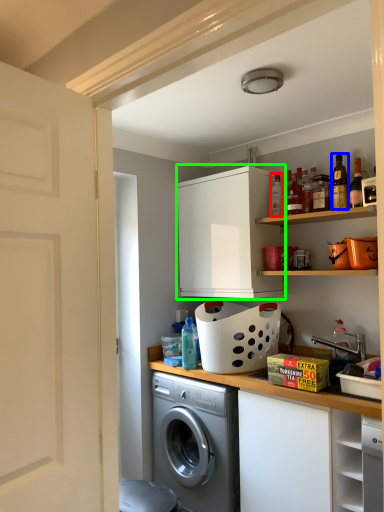
Question: Estimate the real-world distances between objects in this image. Which object is closer to bottle (highlighted by a red box), bottle (highlighted by a blue box) or cabinetry (highlighted by a green box)?

Choices:
 (A) bottle
 (B) cabinetry

Answer: (A)